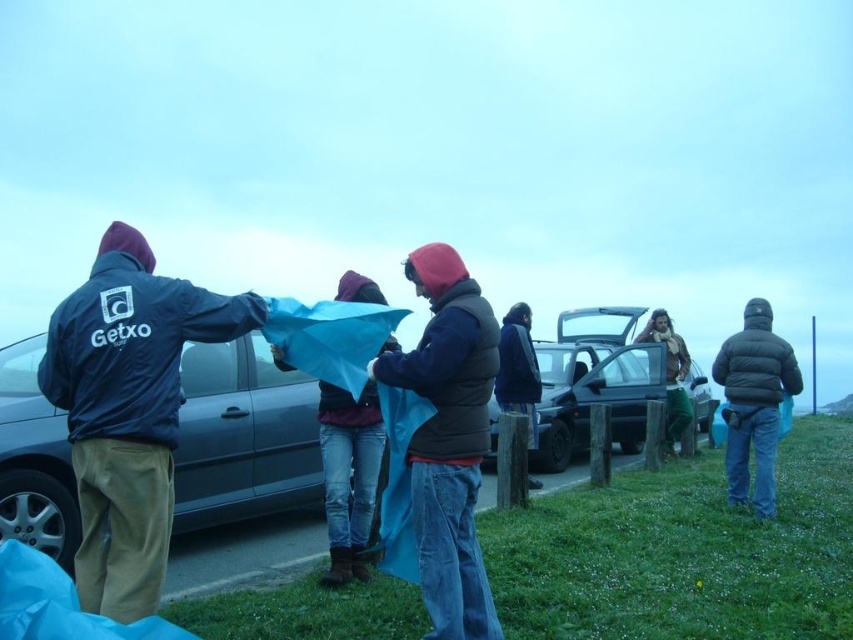
You are a photographer trying to capture a shot of the metallic silver car at center and the blue fabric at center. From the photographer perspective, which object is located to the right side?

The metallic silver car at center is positioned on the right side of blue fabric at center, so from the photographer perspective, the metallic silver car at center is located to the right side of the blue fabric at center.

You are planning to take a photo of the dark blue puffy vest at center and the metallic silver car at center. Which object will appear smaller in the photo?

The dark blue puffy vest at center will appear smaller in the photo because it occupies less space than the metallic silver car at center.